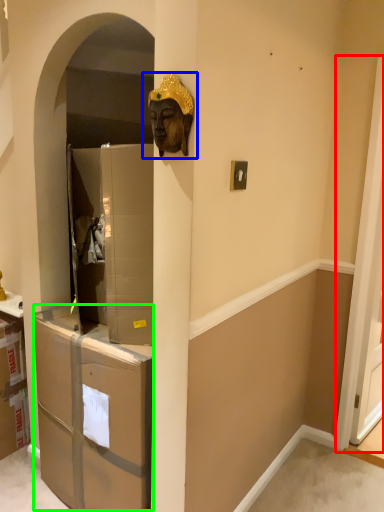
Question: Considering the real-world distances, which object is farthest from screen door (highlighted by a red box)? bronze statue (highlighted by a blue box) or drawer (highlighted by a green box)?

Choices:
 (A) bronze statue
 (B) drawer

Answer: (A)